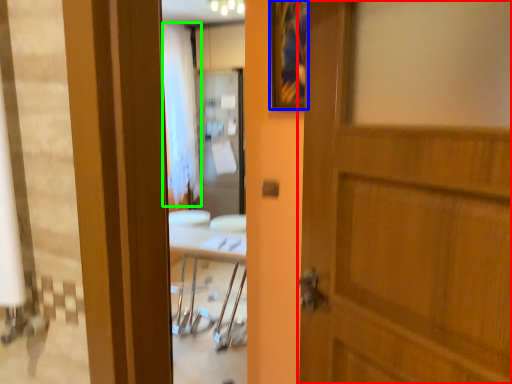
Question: Which object is positioned farthest from door (highlighted by a red box)? Select from picture frame (highlighted by a blue box) and curtain (highlighted by a green box).

Choices:
 (A) picture frame
 (B) curtain

Answer: (B)